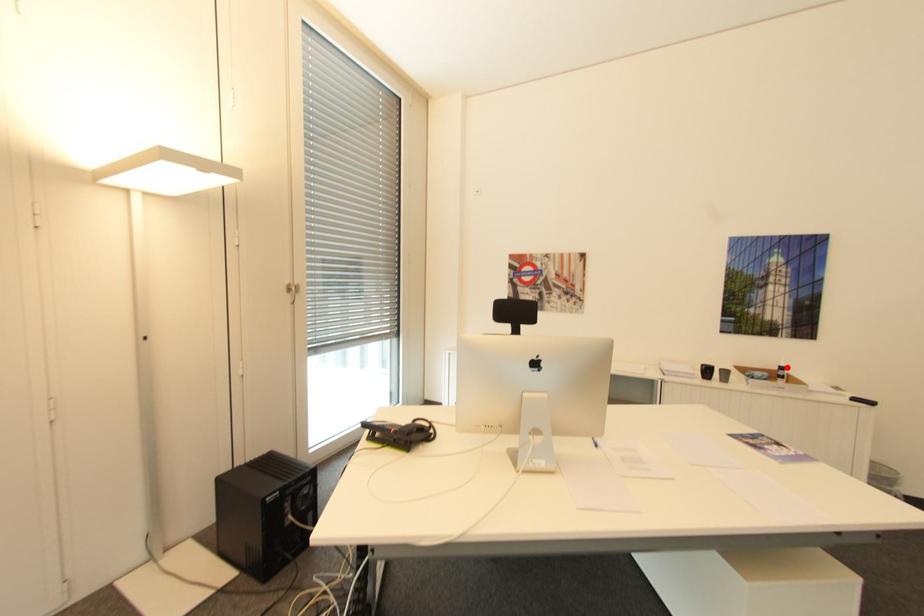
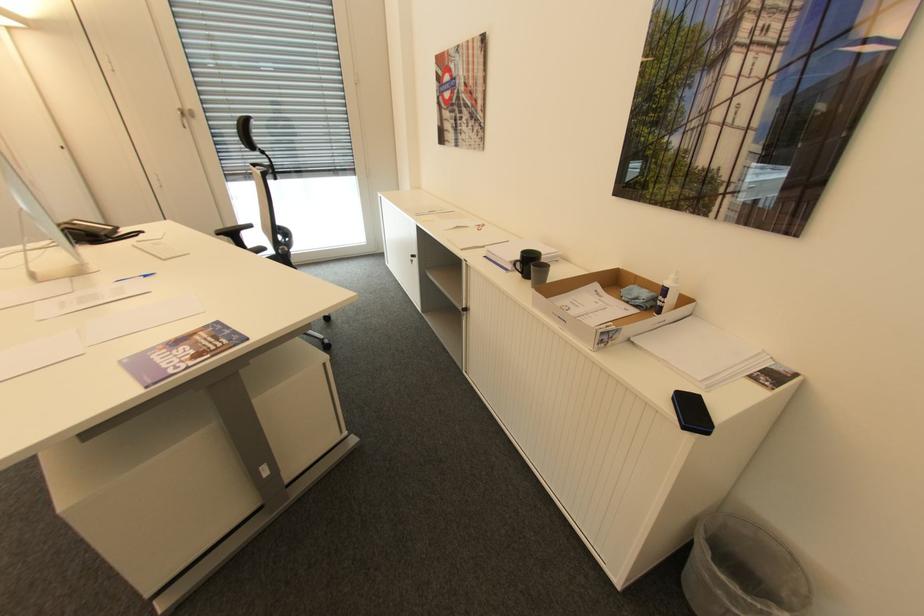
Locate, in the second image, the point that corresponds to the highlighted location in the first image.

(670, 291)